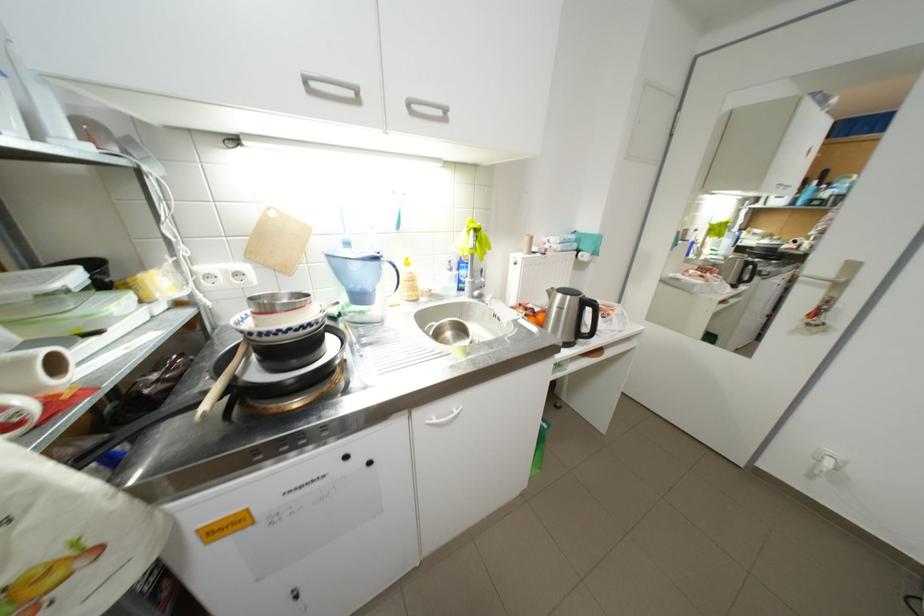
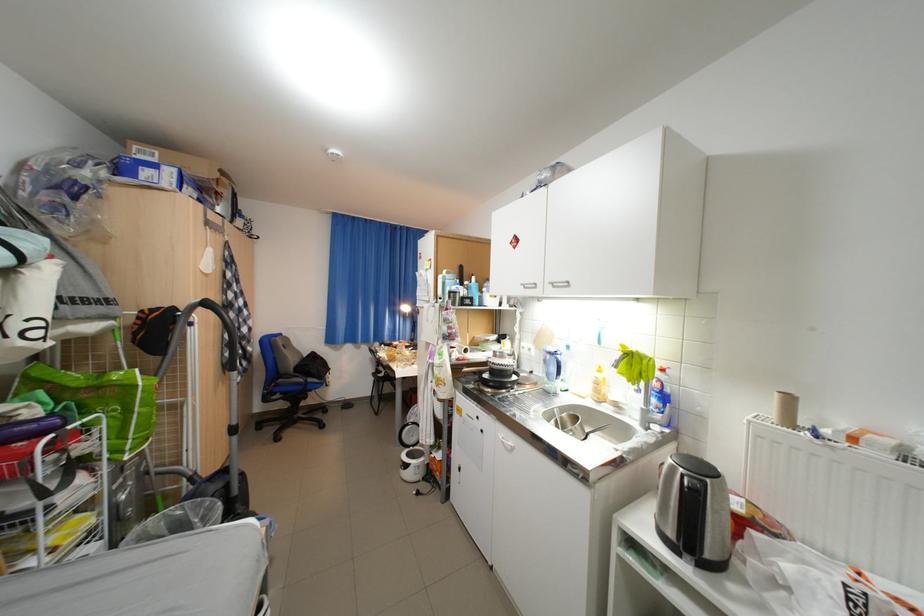
Where in the second image is the point corresponding to (410,306) from the first image?

(594, 399)